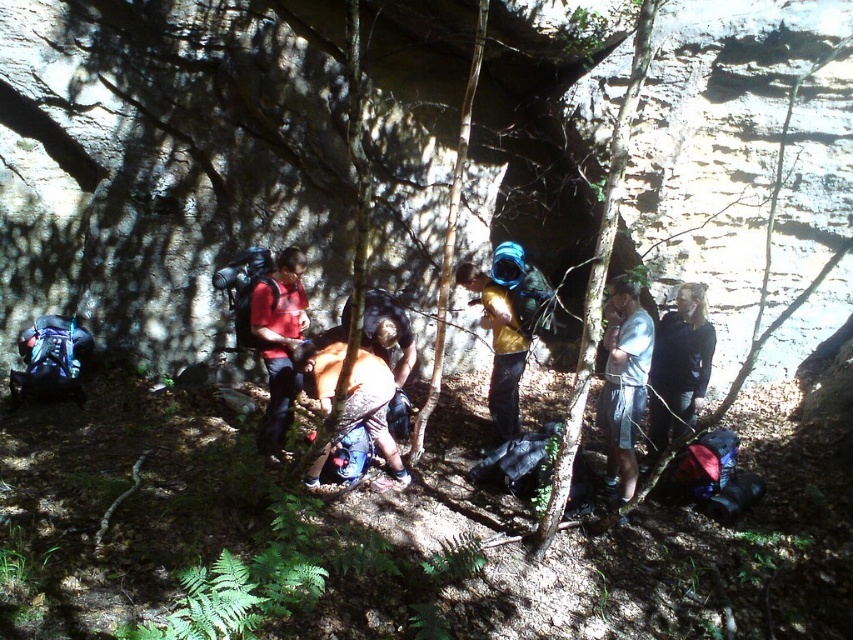
Is matte red shirt at center closer to camera compared to yellow matte shirt at center?

Yes, it is.

At what (x,y) coordinates should I click in order to perform the action: click on matte red shirt at center. Please return your answer as a coordinate pair (x, y). The height and width of the screenshot is (640, 853). Looking at the image, I should click on (279, 340).

The width and height of the screenshot is (853, 640). In order to click on matte red shirt at center in this screenshot , I will do `click(279, 340)`.

Image resolution: width=853 pixels, height=640 pixels. Find the location of `matte red shirt at center`. matte red shirt at center is located at coordinates (279, 340).

Between point (701, 365) and point (497, 349), which one is positioned behind?

Point (497, 349)

Who is positioned more to the right, black matte jacket at right or yellow matte shirt at center?

Positioned to the right is black matte jacket at right.

The image size is (853, 640). What are the coordinates of `black matte jacket at right` in the screenshot? It's located at (679, 368).

Identify the location of black matte jacket at right. The width and height of the screenshot is (853, 640). (679, 368).

Can you confirm if light blue denim shorts at center is shorter than black matte jacket at right?

No, light blue denim shorts at center is not shorter than black matte jacket at right.

Is point (625, 426) closer to camera compared to point (674, 369)?

Yes, point (625, 426) is closer to viewer.

The height and width of the screenshot is (640, 853). Identify the location of light blue denim shorts at center. (624, 380).